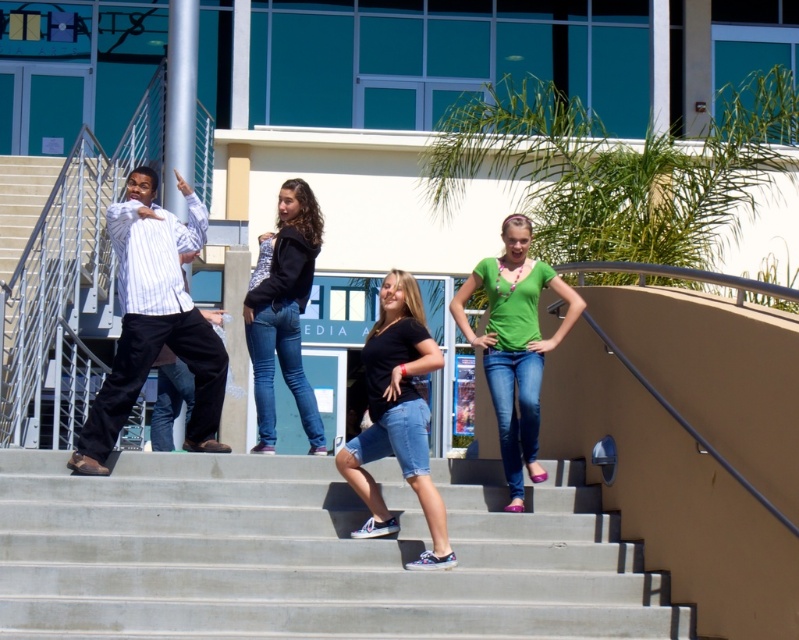
Question: Estimate the real-world distances between objects in this image. Which object is closer to the concrete stairs at center?

Choices:
 (A) striped cotton shirt at left
 (B) black denim shorts at center
 (C) matte black hoodie at center
 (D) green matte shirt at center

Answer: (B)

Question: Is striped cotton shirt at left in front of green matte shirt at center?

Choices:
 (A) yes
 (B) no

Answer: (B)

Question: Does concrete stairs at center appear under striped cotton shirt at left?

Choices:
 (A) yes
 (B) no

Answer: (A)

Question: Considering the real-world distances, which object is closest to the black denim shorts at center?

Choices:
 (A) green matte shirt at center
 (B) concrete stairs at center

Answer: (B)

Question: Is concrete stairs at center thinner than striped cotton shirt at left?

Choices:
 (A) yes
 (B) no

Answer: (B)

Question: Which point is closer to the camera taking this photo?

Choices:
 (A) (400, 349)
 (B) (443, 630)
 (C) (313, 236)

Answer: (B)